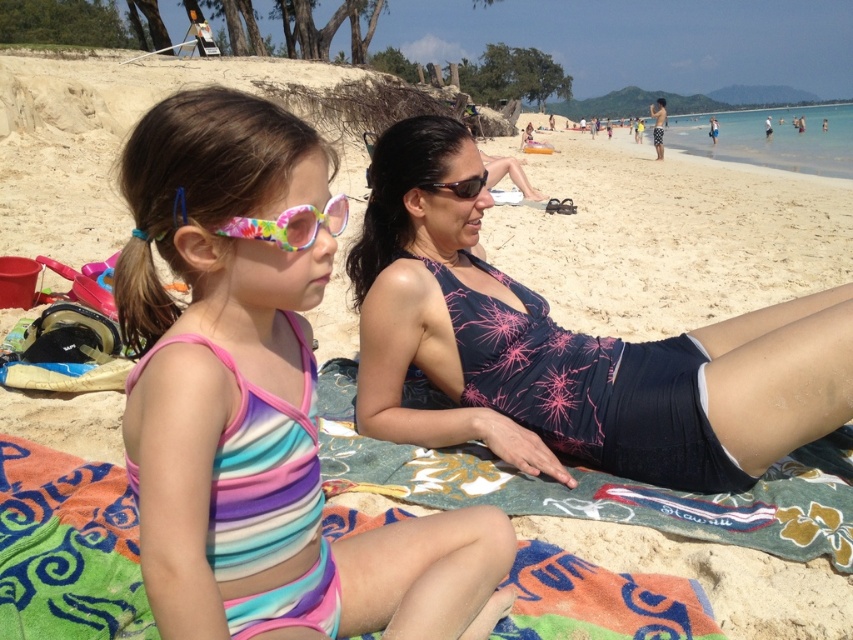
Question: Which object is farther from the camera taking this photo?

Choices:
 (A) multicolored fabric towel at center
 (B) dark blue swimsuit at center
 (C) black plastic sunglasses at center
 (D) striped fabric swimsuit at center

Answer: (C)

Question: Which point appears closest to the camera in this image?

Choices:
 (A) click(x=468, y=195)
 (B) click(x=270, y=227)

Answer: (B)

Question: Does dark blue swimsuit at center have a larger size compared to multicolored fabric towel at center?

Choices:
 (A) no
 (B) yes

Answer: (B)

Question: Considering the relative positions of striped fabric swimsuit at center and black plastic sunglasses at center in the image provided, where is striped fabric swimsuit at center located with respect to black plastic sunglasses at center?

Choices:
 (A) below
 (B) above

Answer: (A)

Question: Estimate the real-world distances between objects in this image. Which object is farther from the multicolored fabric towel at center?

Choices:
 (A) dark blue swimsuit at center
 (B) black plastic sunglasses at center
 (C) tie-dye plastic goggles at center
 (D) striped fabric swimsuit at center

Answer: (B)

Question: Is striped fabric swimsuit at center positioned at the back of tie-dye plastic goggles at center?

Choices:
 (A) yes
 (B) no

Answer: (B)